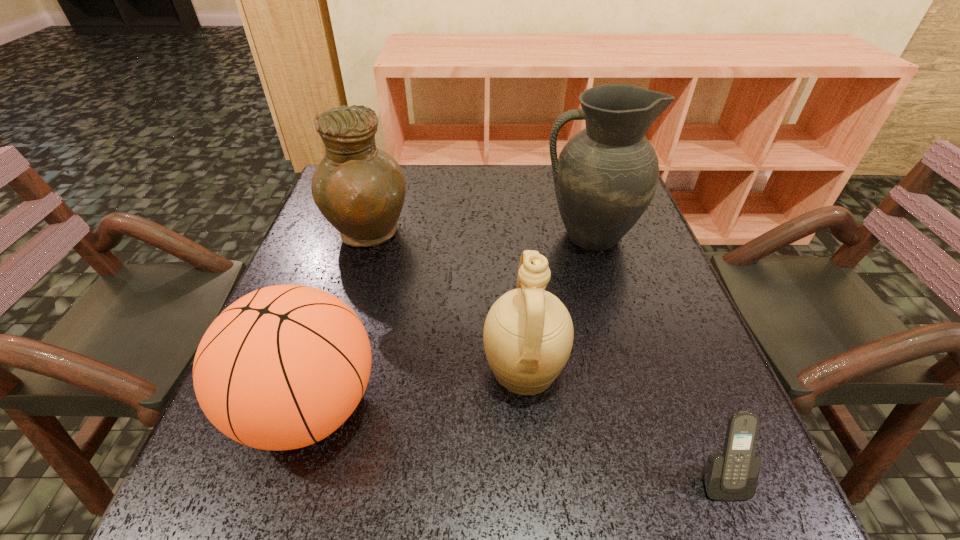
Image resolution: width=960 pixels, height=540 pixels. What are the coordinates of `basketball that is at the left edge` in the screenshot? It's located at (283, 367).

Find the location of a particular element. This screenshot has width=960, height=540. pitcher situated at the right edge is located at coordinates (607, 174).

Identify the location of cellular telephone situated at the right edge. The height and width of the screenshot is (540, 960). (733, 475).

The height and width of the screenshot is (540, 960). I want to click on object that is at the far left corner, so click(x=360, y=189).

At what (x,y) coordinates should I click in order to perform the action: click on object situated at the near left corner. Please return your answer as a coordinate pair (x, y). The width and height of the screenshot is (960, 540). Looking at the image, I should click on (283, 367).

Identify the location of object located at the far right corner. (607, 174).

Identify the location of object that is at the near right corner. This screenshot has height=540, width=960. (733, 475).

In the image, there is a desktop. Where is `free space at the far edge`? free space at the far edge is located at coordinates (408, 169).

Where is `free space at the near edge`? free space at the near edge is located at coordinates (396, 519).

What are the coordinates of `blank space at the left edge of the desktop` in the screenshot? It's located at (347, 255).